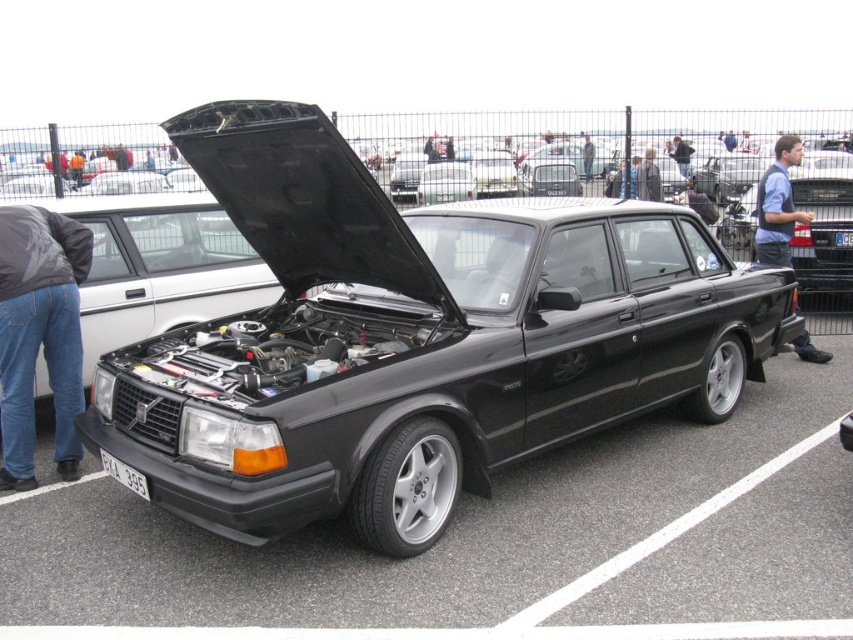
You are a photographer at the car exhibition. You want to take a photo of the white plastic license plate at center without any obstructions. Is the denim jeans at lower left blocking the view of the license plate?

The denim jeans at lower left is positioned under the white plastic license plate at center, so it will block the view of the license plate. Move the denim jeans at lower left to capture an unobstructed photo of the white plastic license plate at center.

You are a parking attendant at the car exhibition. You need to ensure that the license plates are visible for security cameras. Which license plate, the white plastic license plate at lower center or the white plastic license plate at center, is larger and thus easier to read from a distance?

The white plastic license plate at lower center is bigger than the white plastic license plate at center, making it easier to read from a distance.